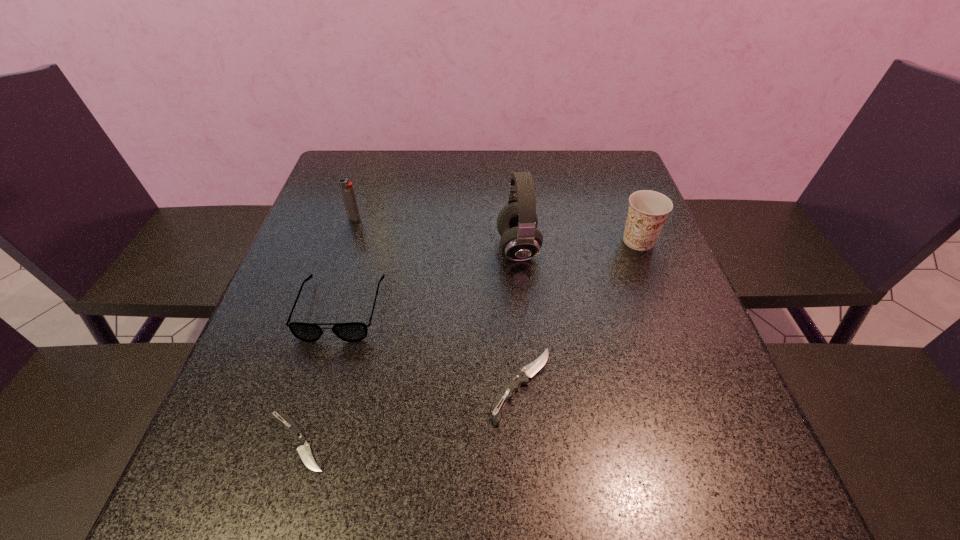
This screenshot has width=960, height=540. In order to click on vacant space located 0.300m on the back of the fifth tallest object in this screenshot , I will do `click(511, 247)`.

This screenshot has width=960, height=540. Identify the location of vacant region located 0.360m on the right of the igniter. (499, 219).

You are a GUI agent. You are given a task and a screenshot of the screen. Output one action in this format:
    pyautogui.click(x=<x>, y=<y>)
    Task: Click on the free location located 0.080m on the ear cups of the headset
    This screenshot has width=960, height=540.
    Given the screenshot: What is the action you would take?
    pyautogui.click(x=464, y=248)

Image resolution: width=960 pixels, height=540 pixels. I want to click on vacant space situated on the ear cups of the headset, so click(x=339, y=248).

Image resolution: width=960 pixels, height=540 pixels. What are the coordinates of `free region located 0.170m on the ear cups of the headset` in the screenshot? It's located at (426, 248).

Find the location of a particular element. vacant space located 0.060m on the left of the rightmost object is located at coordinates (594, 241).

At what (x,y) coordinates should I click in order to perform the action: click on free location located on the front-facing side of the third nearest object. Please return your answer as a coordinate pair (x, y). Looking at the image, I should click on (303, 436).

Locate an element on the screen. The image size is (960, 540). pocketknife present at the left edge is located at coordinates (303, 448).

Find the location of a particular element. This screenshot has height=540, width=960. igniter that is at the left edge is located at coordinates 347,190.

Where is `spectacles located in the left edge section of the desktop`? The height and width of the screenshot is (540, 960). spectacles located in the left edge section of the desktop is located at coordinates (353, 331).